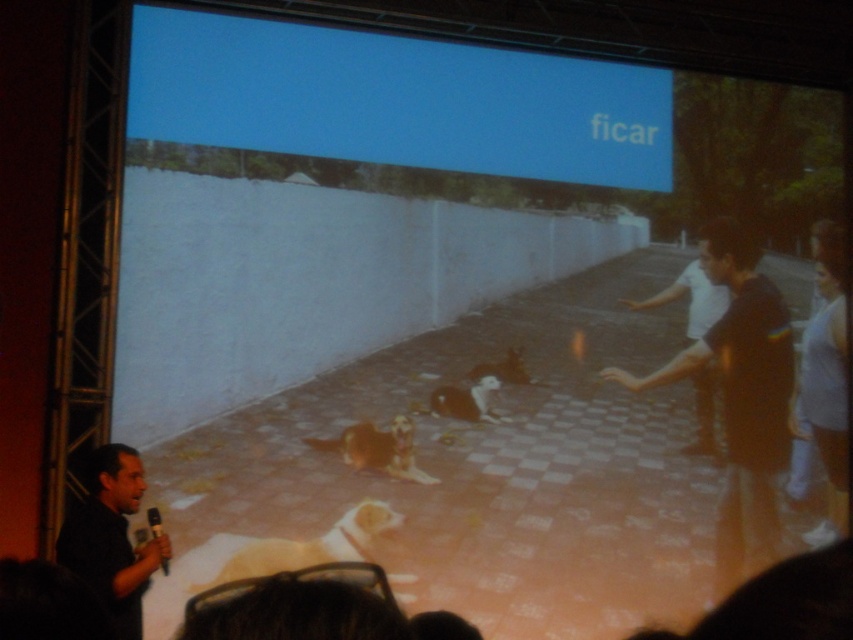
You are an attendee at the lecture and want to focus on the two points mentioned on the projection screen. Which point, point [601,140] or point [740,445], is closer to you as an attendee?

Point [601,140] is further to the camera than point [740,445], so the point closer to you as an attendee would be point [740,445].

You are an attendee at the presentation. The speaker is on your left, and you are facing the same direction as him. Where is the blue matte projection screen at upper center located relative to your position?

The blue matte projection screen at upper center is located to your right side because the speaker is on your left, and you are facing the same direction as him. Since the screen is at upper center in the image, which corresponds to the coordinate point mentioned, it would be positioned to your right relative to your facing direction.

You are an attendee sitting in the front row of the lecture hall. You notice the black matte shirt at lower left and the light brown fur dog at lower center in the projection. Which object is nearer to you?

The black matte shirt at lower left is closer to the viewer than the light brown fur dog at lower center.